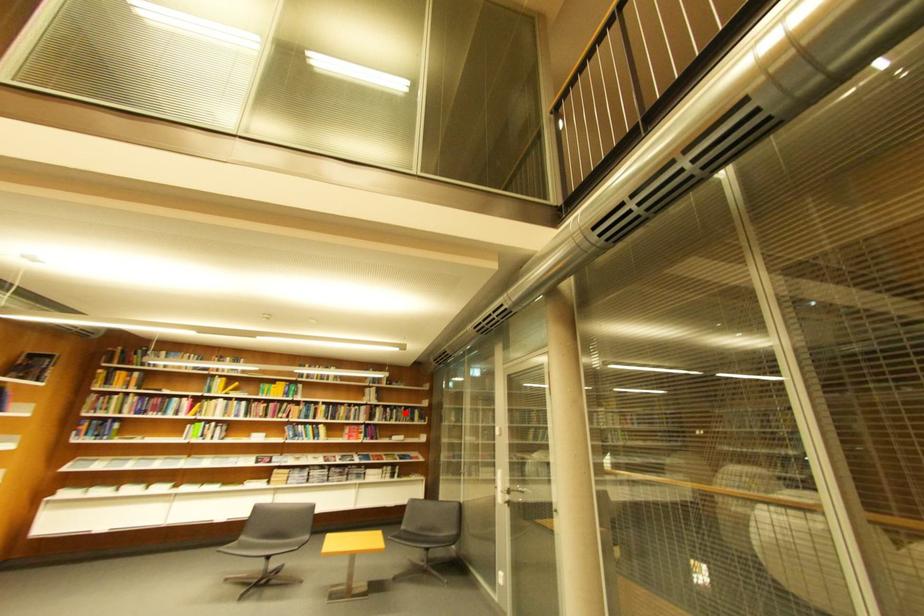
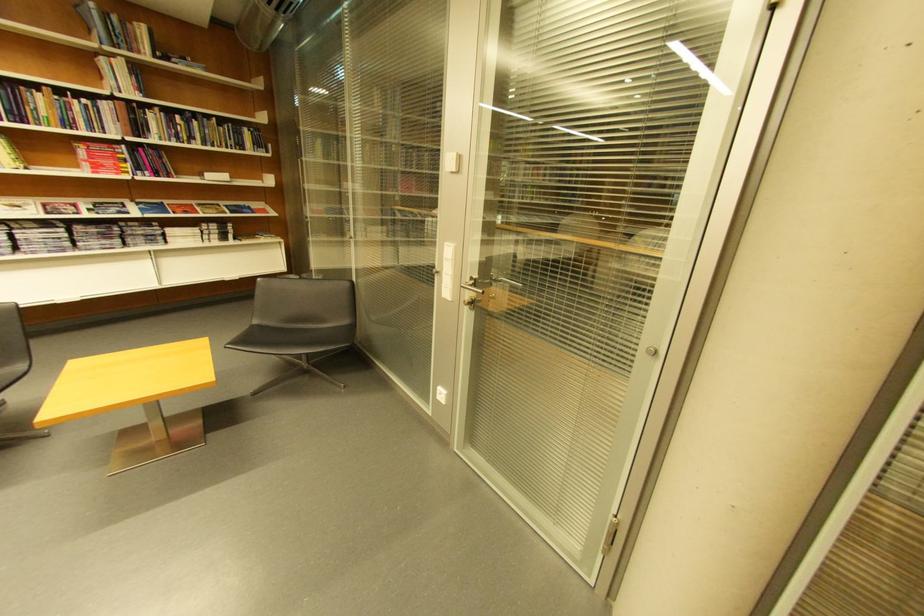
Where in the second image is the point corresponding to the highlighted location from the first image?

(205, 124)